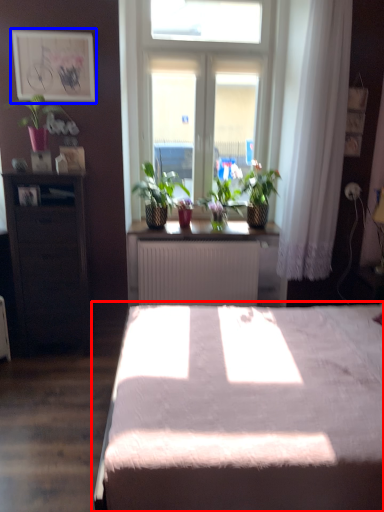
Question: Which point is further to the camera, bed (highlighted by a red box) or picture frame (highlighted by a blue box)?

Choices:
 (A) bed
 (B) picture frame

Answer: (B)